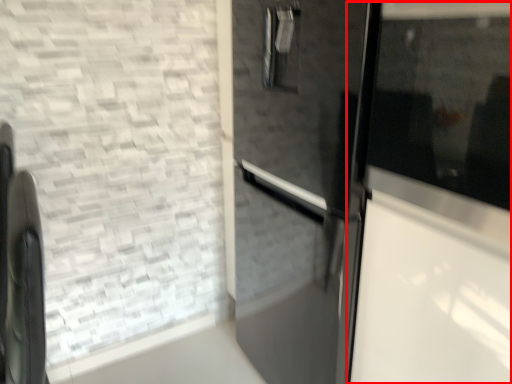
Question: Where is glass door (annotated by the red box) located in relation to appliance in the image?

Choices:
 (A) right
 (B) left

Answer: (A)